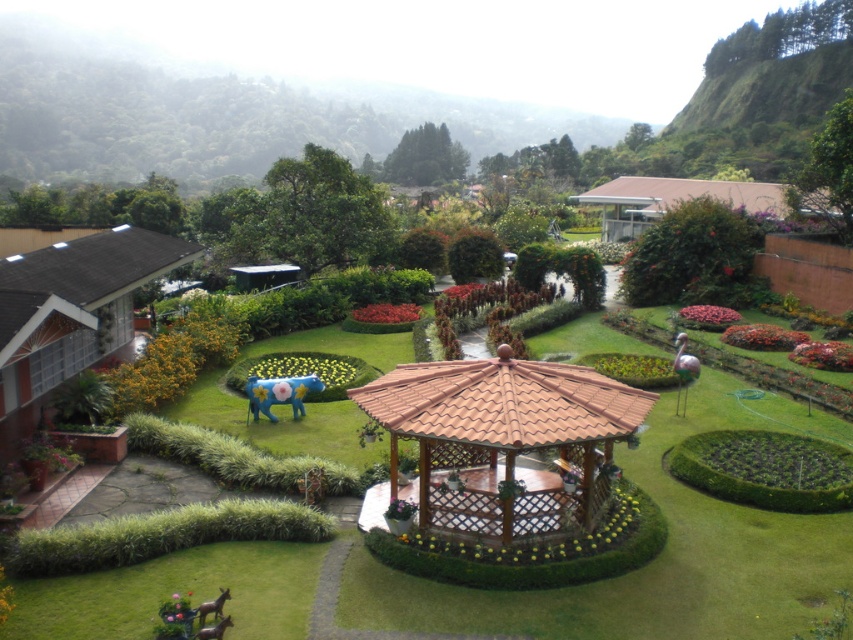
You are standing in the garden and want to take a photo of the brown wooden gazebo at center. If your camera has a maximum focus range of 15 meters, will you be able to capture it clearly?

The brown wooden gazebo at center is 15.70 meters away from the viewer. Since the camera can only focus up to 15 meters, it won cannot capture the gazebo clearly within the focus range.

You are standing at the entrance of the garden and see the brown wooden gazebo at center and the brown wooden horse at lower left. Which object is higher up in the image?

The brown wooden gazebo at center is above the brown wooden horse at lower left, so it is higher up in the image.

You are standing at the entrance of the garden and want to take a photo of both the brown wooden gazebo at center and the brown wooden horse at lower left. From your current position, can you see both objects in the same frame without moving?

The brown wooden horse at lower left is behind the brown wooden gazebo at center, so it might be partially or fully obscured from your current position. You may need to adjust your angle or move closer to ensure both are visible in the frame.